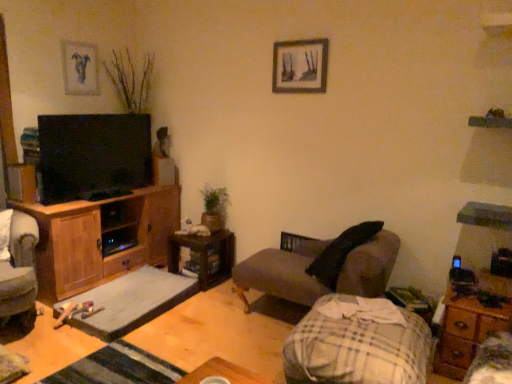
Locate an element on the screen. This screenshot has height=384, width=512. vacant area in front of brown wooden side table at center is located at coordinates (214, 299).